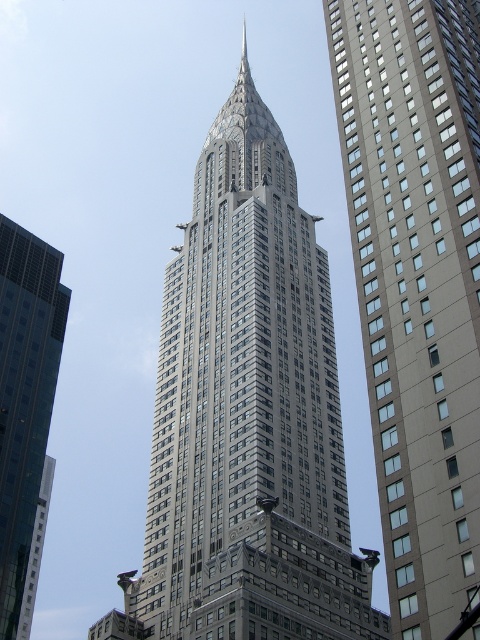
Question: Based on their relative distances, which object is nearer to the glassy reflective skyscraper at left?

Choices:
 (A) gray metallic skyscraper at center
 (B) gray glass skyscraper at center

Answer: (A)

Question: In this image, where is gray metallic skyscraper at center located relative to gray glass skyscraper at center?

Choices:
 (A) right
 (B) left

Answer: (B)

Question: Which object appears closest to the camera in this image?

Choices:
 (A) gray glass skyscraper at center
 (B) gray metallic skyscraper at center

Answer: (A)

Question: Can you confirm if gray metallic skyscraper at center is positioned to the right of gray glass skyscraper at center?

Choices:
 (A) no
 (B) yes

Answer: (A)

Question: Estimate the real-world distances between objects in this image. Which object is closer to the gray metallic skyscraper at center?

Choices:
 (A) glassy reflective skyscraper at left
 (B) gray glass skyscraper at center

Answer: (A)

Question: Is gray metallic skyscraper at center further to the viewer compared to glassy reflective skyscraper at left?

Choices:
 (A) no
 (B) yes

Answer: (A)